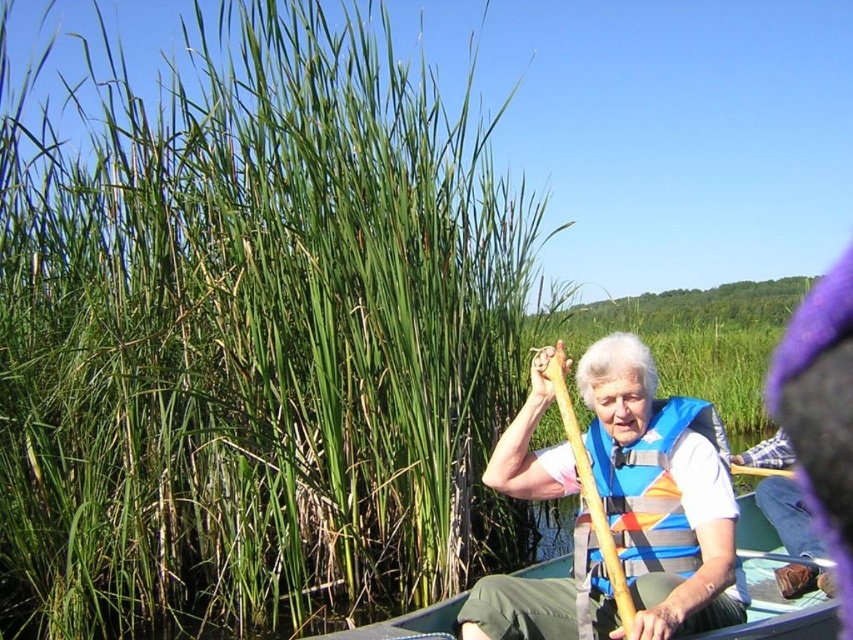
Question: Can you confirm if blue life vest at center is positioned below wooden paddle at center?

Choices:
 (A) no
 (B) yes

Answer: (B)

Question: Is green plastic canoe at center positioned before wooden paddle at center?

Choices:
 (A) yes
 (B) no

Answer: (B)

Question: Among these objects, which one is nearest to the camera?

Choices:
 (A) blue life vest at center
 (B) wooden paddle at center
 (C) green plastic canoe at center
 (D) green grass at upper left

Answer: (A)

Question: Does green grass at upper left have a lesser width compared to green plastic canoe at center?

Choices:
 (A) yes
 (B) no

Answer: (B)

Question: Which point is closer to the camera?

Choices:
 (A) green grass at upper left
 (B) wooden paddle at center
 (C) blue life vest at center

Answer: (C)

Question: Which of the following is the farthest from the observer?

Choices:
 (A) click(x=572, y=416)
 (B) click(x=556, y=488)

Answer: (B)